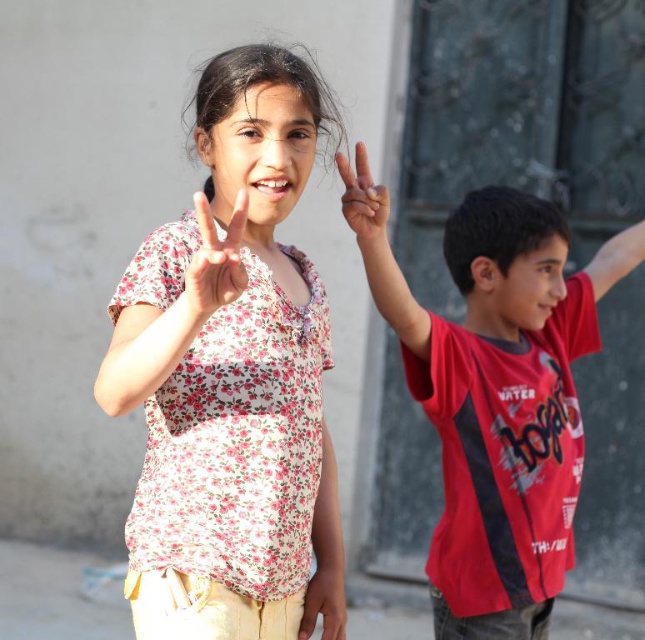
Between red matte shirt at right and matte floral shirt at center, which one appears on the right side from the viewer's perspective?

red matte shirt at right

Is point (561, 534) closer to camera compared to point (319, 605)?

No, it is not.

Is point (491, 493) more distant than point (322, 598)?

Yes, it is.

Find the location of a particular element. This screenshot has height=640, width=645. red matte shirt at right is located at coordinates click(499, 388).

Is floral fabric shirt at center taller than matte pink hand at center?

Yes, floral fabric shirt at center is taller than matte pink hand at center.

This screenshot has height=640, width=645. What do you see at coordinates (232, 346) in the screenshot? I see `floral fabric shirt at center` at bounding box center [232, 346].

Between point (232, 557) and point (382, 227), which one is positioned in front?

Point (232, 557) is more forward.

You are a GUI agent. You are given a task and a screenshot of the screen. Output one action in this format:
    pyautogui.click(x=<x>, y=<y>)
    Task: Click on the floral fabric shirt at center
    This screenshot has height=640, width=645.
    Given the screenshot: What is the action you would take?
    [x=232, y=346]

Does red matte shirt at right have a lesser width compared to matte pink hand at center?

Incorrect, red matte shirt at right's width is not less than matte pink hand at center's.

Is point (553, 412) behind point (364, 221)?

That is True.

Locate an element on the screen. Image resolution: width=645 pixels, height=640 pixels. red matte shirt at right is located at coordinates (499, 388).